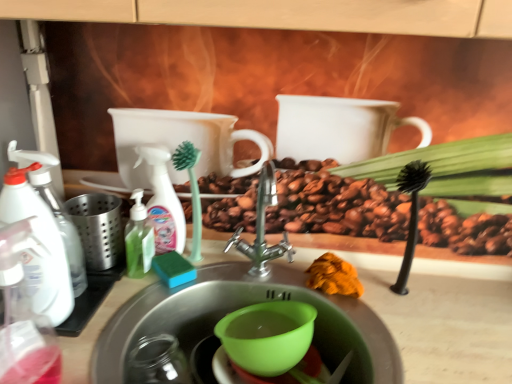
Find the location of a particular element. vacant area that is in front of green plastic spray bottle at center, the 1th cleaning product from the right is located at coordinates (133, 306).